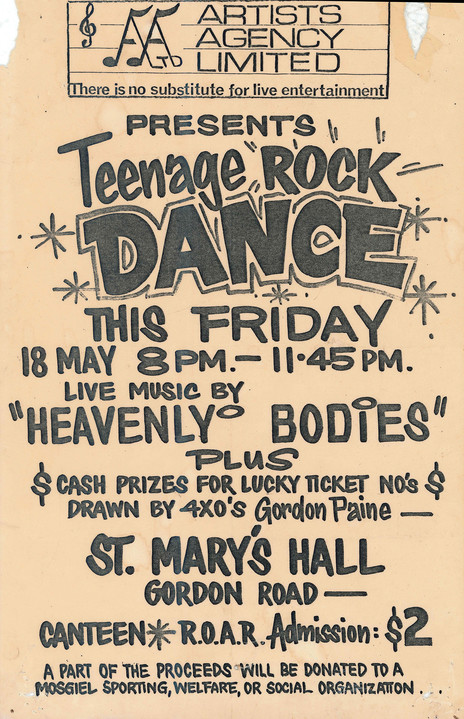
The image size is (464, 719). I want to click on poster for a dance, so click(15, 162).